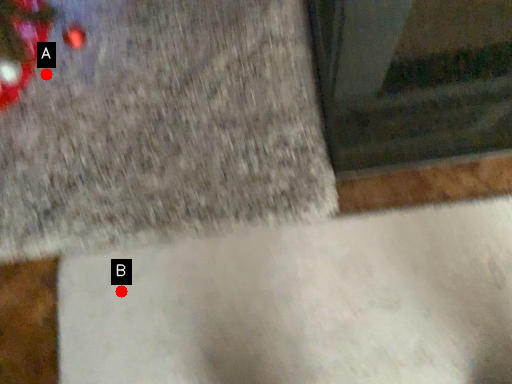
Question: Two points are circled on the image, labeled by A and B beside each circle. Which point appears closest to the camera in this image?

Choices:
 (A) A is closer
 (B) B is closer

Answer: (B)